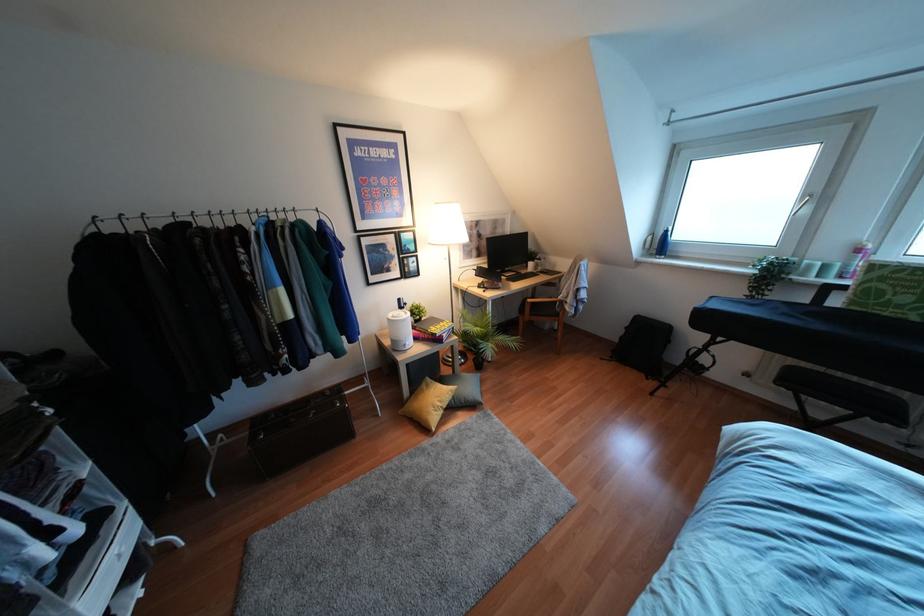
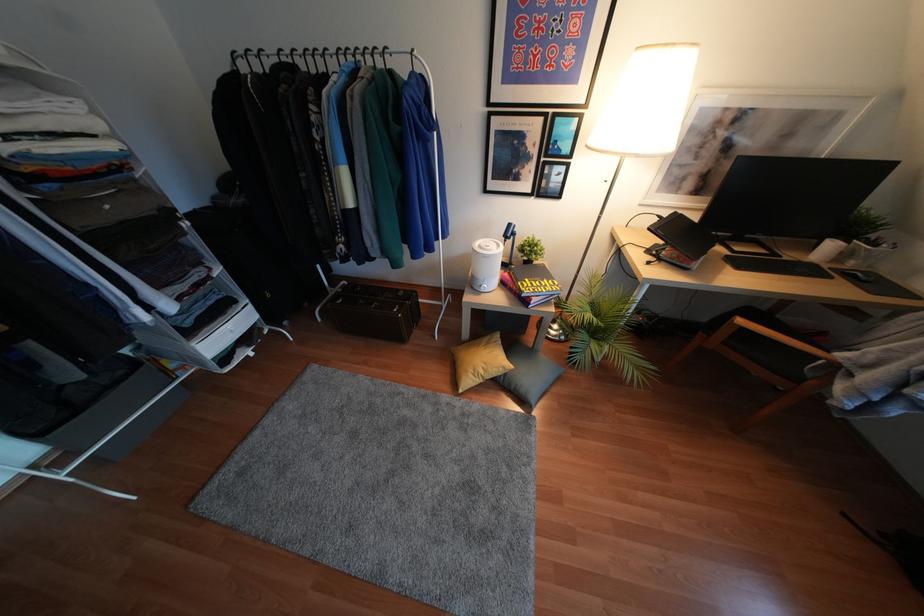
Where in the second image is the point corresponding to [439,403] from the first image?

(480, 371)